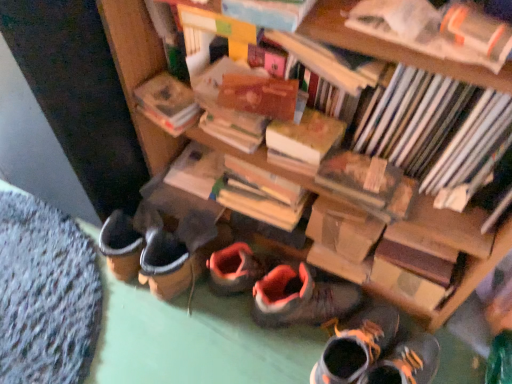
Locate an element on the screen. This screenshot has width=512, height=384. vacant space to the left of leather boot at lower center, the 2th footwear positioned from the left is located at coordinates (283, 351).